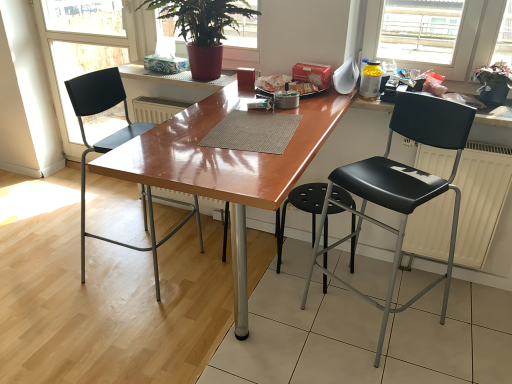
Image resolution: width=512 pixels, height=384 pixels. What are the coordinates of `vacant location below glossy wood desk at center (from a real-world perspective)` in the screenshot? It's located at (251, 333).